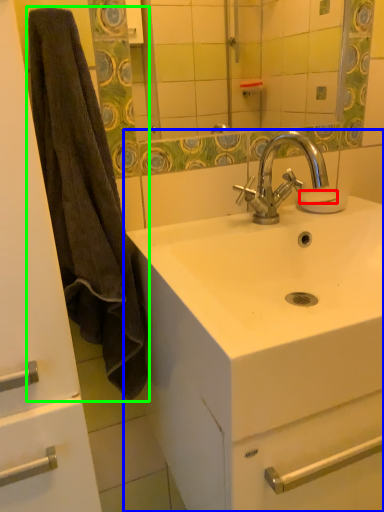
Question: Which object is positioned closest to soap (highlighted by a red box)? Select from sink (highlighted by a blue box) and bath towel (highlighted by a green box).

Choices:
 (A) sink
 (B) bath towel

Answer: (A)